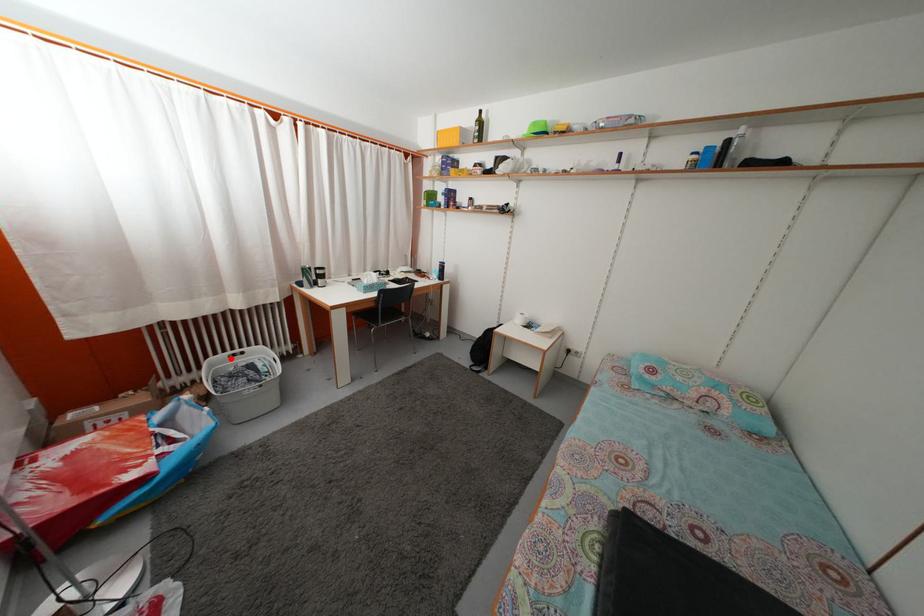
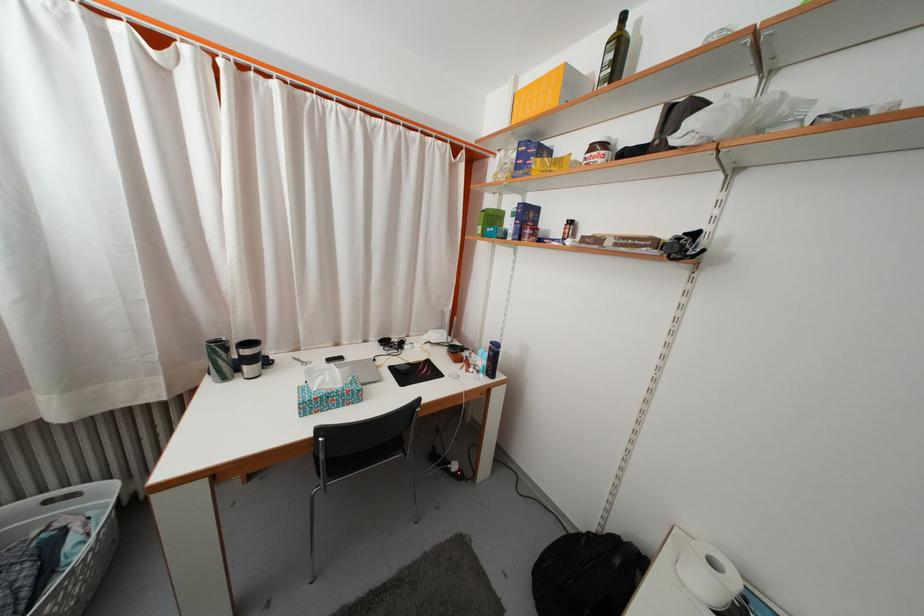
Question: I am providing you with two images of the same scene from different viewpoints. In image1, a red point is highlighted. Considering the same 3D point in image2, which of the following is correct?

Choices:
 (A) It is closer
 (B) It is farther

Answer: (A)